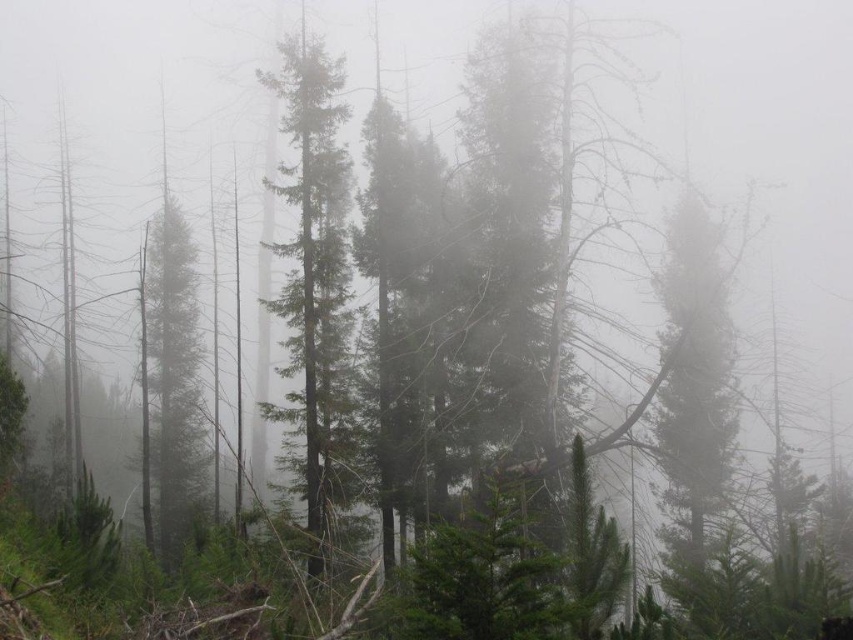
Does green textured tree at right have a greater height compared to green textured tree at center?

In fact, green textured tree at right may be shorter than green textured tree at center.

Which is below, green textured tree at right or green textured tree at center?

green textured tree at right is lower down.

Find the location of a particular element. The image size is (853, 640). green textured tree at right is located at coordinates (694, 390).